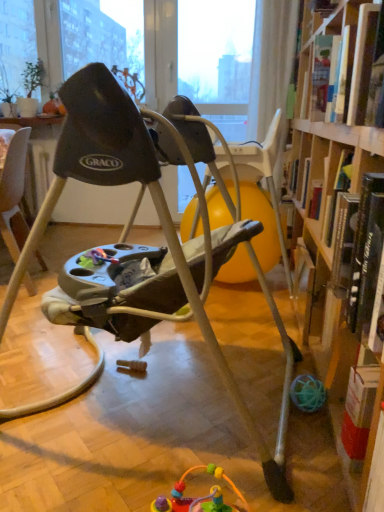
Measure the distance between hardcover book at right, which is counted as the first book, starting from the bottom, and camera.

76.15 centimeters.

Describe the element at coordinates (342, 64) in the screenshot. I see `hardcover book at upper right, which ranks as the 1th book in top-to-bottom order` at that location.

Locate an element on the screen. The height and width of the screenshot is (512, 384). gray plastic baby swing at center is located at coordinates (137, 245).

This screenshot has width=384, height=512. I want to click on hardcover book at right, which appears as the second book when viewed from the top, so click(x=361, y=240).

Which is more to the left, hardcover book at upper right, which ranks as the 2th book in bottom-to-top order, or gray plastic baby swing at center?

Positioned to the left is gray plastic baby swing at center.

Does point (358, 125) appear closer or farther from the camera than point (284, 471)?

Point (358, 125) is closer to the camera than point (284, 471).

Is hardcover book at upper right, which ranks as the 1th book in top-to-bottom order, further to camera compared to gray plastic baby swing at center?

Yes, hardcover book at upper right, which ranks as the 1th book in top-to-bottom order, is behind gray plastic baby swing at center.

Can we say hardcover book at upper right, which ranks as the 1th book in top-to-bottom order, lies outside gray plastic baby swing at center?

Yes, hardcover book at upper right, which ranks as the 1th book in top-to-bottom order, is located beyond the bounds of gray plastic baby swing at center.

Who is shorter, hardcover book at right, which is counted as the first book, starting from the bottom, or gray plastic baby swing at center?

With less height is hardcover book at right, which is counted as the first book, starting from the bottom.

From the image's perspective, would you say hardcover book at right, which appears as the second book when viewed from the top, is positioned over gray plastic baby swing at center?

Actually, hardcover book at right, which appears as the second book when viewed from the top, appears below gray plastic baby swing at center in the image.

This screenshot has height=512, width=384. I want to click on chair on the left of hardcover book at right, which is counted as the first book, starting from the bottom, so click(x=137, y=245).

Looking at this image, which of these two, hardcover book at right, which is counted as the first book, starting from the bottom, or gray plastic baby swing at center, is smaller?

hardcover book at right, which is counted as the first book, starting from the bottom.

How far apart are gray plastic baby swing at center and hardcover book at right, which is counted as the first book, starting from the bottom?

gray plastic baby swing at center is 19.39 inches away from hardcover book at right, which is counted as the first book, starting from the bottom.

Is gray plastic baby swing at center not close to hardcover book at right, which is counted as the first book, starting from the bottom?

No, there isn't a large distance between gray plastic baby swing at center and hardcover book at right, which is counted as the first book, starting from the bottom.

From the picture: Between gray plastic baby swing at center and hardcover book at right, which appears as the second book when viewed from the top, which one appears on the left side from the viewer's perspective?

gray plastic baby swing at center.

From the image's perspective, relative to hardcover book at right, which appears as the second book when viewed from the top, is gray plastic baby swing at center above or below?

Based on their image positions, gray plastic baby swing at center is located above hardcover book at right, which appears as the second book when viewed from the top.

Who is taller, hardcover book at right, which appears as the second book when viewed from the top, or hardcover book at upper right, which ranks as the 1th book in top-to-bottom order?

With more height is hardcover book at right, which appears as the second book when viewed from the top.

Is hardcover book at right, which appears as the second book when viewed from the top, oriented towards hardcover book at upper right, which ranks as the 2th book in bottom-to-top order?

No, hardcover book at right, which appears as the second book when viewed from the top, is not oriented towards hardcover book at upper right, which ranks as the 2th book in bottom-to-top order.

Based on their positions, is hardcover book at right, which appears as the second book when viewed from the top, located to the left or right of hardcover book at upper right, which ranks as the 1th book in top-to-bottom order?

hardcover book at right, which appears as the second book when viewed from the top, is positioned on hardcover book at upper right, which ranks as the 1th book in top-to-bottom order,'s left side.

At what (x,y) coordinates should I click in order to perform the action: click on book that appears above the hardcover book at right, which is counted as the first book, starting from the bottom (from the image's perspective). Please return your answer as a coordinate pair (x, y). Looking at the image, I should click on (342, 64).

Is point (194, 152) closer or farther from the camera than point (332, 82)?

Point (194, 152).

From a real-world perspective, which object rests below the other?

gray plastic baby swing at center.

Does gray plastic baby swing at center lie in front of hardcover book at upper right, which ranks as the 1th book in top-to-bottom order?

Yes, the depth of gray plastic baby swing at center is less than that of hardcover book at upper right, which ranks as the 1th book in top-to-bottom order.

How much distance is there between gray plastic baby swing at center and hardcover book at upper right, which ranks as the 2th book in bottom-to-top order?

gray plastic baby swing at center is 60.46 centimeters away from hardcover book at upper right, which ranks as the 2th book in bottom-to-top order.

Is hardcover book at upper right, which ranks as the 1th book in top-to-bottom order, positioned with its back to hardcover book at right, which is counted as the first book, starting from the bottom?

hardcover book at upper right, which ranks as the 1th book in top-to-bottom order, is not turned away from hardcover book at right, which is counted as the first book, starting from the bottom.

Where is `book located below the hardcover book at upper right, which ranks as the 1th book in top-to-bottom order (from the image's perspective)`? This screenshot has width=384, height=512. book located below the hardcover book at upper right, which ranks as the 1th book in top-to-bottom order (from the image's perspective) is located at coordinates [x=361, y=240].

Measure the distance from hardcover book at upper right, which ranks as the 2th book in bottom-to-top order, to hardcover book at right, which is counted as the first book, starting from the bottom.

hardcover book at upper right, which ranks as the 2th book in bottom-to-top order, and hardcover book at right, which is counted as the first book, starting from the bottom, are 19.81 inches apart.

Looking at this image, which point is more forward, (367, 76) or (342, 290)?

The point (367, 76) is closer to the camera.

From a real-world perspective, starting from the gray plastic baby swing at center, which book is the 2nd one vertically above it? Please provide its 2D coordinates.

[(342, 64)]

This screenshot has height=512, width=384. In order to click on chair in front of the hardcover book at right, which is counted as the first book, starting from the bottom in this screenshot , I will do (137, 245).

Which object lies nearer to the anchor point gray plastic baby swing at center, hardcover book at upper right, which ranks as the 1th book in top-to-bottom order, or hardcover book at right, which is counted as the first book, starting from the bottom?

Based on the image, hardcover book at right, which is counted as the first book, starting from the bottom, appears to be nearer to gray plastic baby swing at center.

Based on their spatial positions, is gray plastic baby swing at center or hardcover book at upper right, which ranks as the 1th book in top-to-bottom order, closer to hardcover book at right, which appears as the second book when viewed from the top?

Among the two, gray plastic baby swing at center is located nearer to hardcover book at right, which appears as the second book when viewed from the top.

Which object lies nearer to the anchor point hardcover book at upper right, which ranks as the 1th book in top-to-bottom order, gray plastic baby swing at center or hardcover book at right, which is counted as the first book, starting from the bottom?

hardcover book at right, which is counted as the first book, starting from the bottom, is positioned closer to the anchor hardcover book at upper right, which ranks as the 1th book in top-to-bottom order.

Estimate the real-world distances between objects in this image. Which object is further from hardcover book at upper right, which ranks as the 1th book in top-to-bottom order, hardcover book at right, which appears as the second book when viewed from the top, or gray plastic baby swing at center?

The object further to hardcover book at upper right, which ranks as the 1th book in top-to-bottom order, is gray plastic baby swing at center.

Which object lies further to the anchor point gray plastic baby swing at center, hardcover book at right, which is counted as the first book, starting from the bottom, or hardcover book at upper right, which ranks as the 2th book in bottom-to-top order?

Among the two, hardcover book at upper right, which ranks as the 2th book in bottom-to-top order, is located further to gray plastic baby swing at center.

From the image, which object appears to be nearer to hardcover book at right, which appears as the second book when viewed from the top, hardcover book at upper right, which ranks as the 1th book in top-to-bottom order, or gray plastic baby swing at center?

gray plastic baby swing at center.

Find the location of a particular element. This screenshot has height=512, width=384. book between gray plastic baby swing at center and hardcover book at upper right, which ranks as the 2th book in bottom-to-top order, in the horizontal direction is located at coordinates (361, 240).